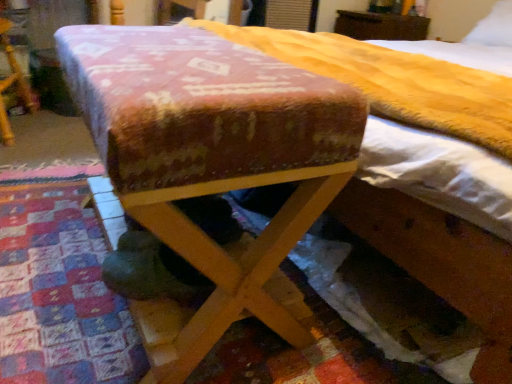
You are a GUI agent. You are given a task and a screenshot of the screen. Output one action in this format:
    pyautogui.click(x=<x>, y=<y>)
    Task: Click on the textured wool mattress at center
    
    Given the screenshot: What is the action you would take?
    (395, 82)

The height and width of the screenshot is (384, 512). What do you see at coordinates (211, 156) in the screenshot?
I see `velvet-like fabric ottoman at center, which appears as the 1th furniture when ordered from the bottom` at bounding box center [211, 156].

This screenshot has width=512, height=384. I want to click on white soft pillow at upper right, so click(493, 27).

The width and height of the screenshot is (512, 384). In order to click on wooden bed at center in this screenshot , I will do `click(395, 298)`.

I want to click on brown wooden dresser at upper center, the 1th furniture viewed from the right, so click(381, 26).

Image resolution: width=512 pixels, height=384 pixels. In order to click on textured wool mattress at center in this screenshot , I will do `click(395, 82)`.

From the image's perspective, is velvet-like fabric ottoman at center, the second furniture when ordered from left to right, on white soft pillow at upper right?

No, from the image's perspective, velvet-like fabric ottoman at center, the second furniture when ordered from left to right, is not over white soft pillow at upper right.

Does velvet-like fabric ottoman at center, acting as the 3th furniture starting from the top, have a larger size compared to white soft pillow at upper right?

Yes.

Is velvet-like fabric ottoman at center, acting as the 3th furniture starting from the top, facing towards white soft pillow at upper right?

No, velvet-like fabric ottoman at center, acting as the 3th furniture starting from the top, is not aimed at white soft pillow at upper right.

Are brown wooden dresser at upper center, the 1th furniture viewed from the right, and wooden bed at center beside each other?

No, brown wooden dresser at upper center, the 1th furniture viewed from the right, is not beside wooden bed at center.

Is brown wooden dresser at upper center, the 3th furniture from the bottom, taller than wooden bed at center?

No.

Consider the image. From a real-world perspective, which object rests below the other?

wooden bed at center.

Is brown wooden dresser at upper center, the 1th furniture viewed from the right, smaller than wooden bed at center?

Yes, brown wooden dresser at upper center, the 1th furniture viewed from the right, is smaller than wooden bed at center.

Can you tell me how much velvet-like fabric ottoman at center, acting as the 3th furniture starting from the top, and wooden folding table at center, marked as the 2th furniture in a front-to-back arrangement, differ in facing direction?

94.6 degrees separate the facing orientations of velvet-like fabric ottoman at center, acting as the 3th furniture starting from the top, and wooden folding table at center, marked as the 2th furniture in a front-to-back arrangement.

From the image's perspective, is velvet-like fabric ottoman at center, the second furniture when ordered from left to right, above or below wooden folding table at center, marked as the 2th furniture in a back-to-front arrangement?

velvet-like fabric ottoman at center, the second furniture when ordered from left to right, is situated lower than wooden folding table at center, marked as the 2th furniture in a back-to-front arrangement, in the image.

Does velvet-like fabric ottoman at center, the second furniture in the right-to-left sequence, turn towards wooden folding table at center, positioned as the 2th furniture in bottom-to-top order?

No, velvet-like fabric ottoman at center, the second furniture in the right-to-left sequence, is not oriented towards wooden folding table at center, positioned as the 2th furniture in bottom-to-top order.

Is point (6, 85) closer or farther from the camera than point (362, 27)?

Point (6, 85) appears to be closer to the viewer than point (362, 27).

Does wooden folding table at center, marked as the 2th furniture in a back-to-front arrangement, turn towards brown wooden dresser at upper center, the third furniture viewed from the front?

No, wooden folding table at center, marked as the 2th furniture in a back-to-front arrangement, is not facing towards brown wooden dresser at upper center, the third furniture viewed from the front.

Is wooden folding table at center, positioned as the 2th furniture in bottom-to-top order, at the right side of brown wooden dresser at upper center, the third furniture from the left?

No, wooden folding table at center, positioned as the 2th furniture in bottom-to-top order, is not to the right of brown wooden dresser at upper center, the third furniture from the left.

Locate an element on the screen. furniture that is the 2nd object to the right of the wooden folding table at center, which ranks as the first furniture in left-to-right order, starting at the anchor is located at coordinates (381, 26).

Which object is closer to the camera taking this photo, velvet-like fabric ottoman at center, acting as the 3th furniture starting from the top, or wooden bed at center?

wooden bed at center is in front.

Consider the image. Does velvet-like fabric ottoman at center, the third furniture in the back-to-front sequence, have a lesser height compared to wooden bed at center?

Indeed, velvet-like fabric ottoman at center, the third furniture in the back-to-front sequence, has a lesser height compared to wooden bed at center.

Looking at their sizes, would you say velvet-like fabric ottoman at center, which appears as the 1th furniture when ordered from the bottom, is wider or thinner than wooden bed at center?

velvet-like fabric ottoman at center, which appears as the 1th furniture when ordered from the bottom, is thinner than wooden bed at center.

Are velvet-like fabric ottoman at center, the first furniture when ordered from front to back, and brown wooden dresser at upper center, placed as the 1th furniture when sorted from back to front, making contact?

No, velvet-like fabric ottoman at center, the first furniture when ordered from front to back, is not making contact with brown wooden dresser at upper center, placed as the 1th furniture when sorted from back to front.

Is velvet-like fabric ottoman at center, acting as the 3th furniture starting from the top, not inside brown wooden dresser at upper center, the 3th furniture from the bottom?

Yes.

From the image's perspective, is velvet-like fabric ottoman at center, the third furniture in the back-to-front sequence, below brown wooden dresser at upper center, the third furniture from the left?

Yes.

Is white soft pillow at upper right inside the boundaries of brown wooden dresser at upper center, the third furniture viewed from the front, or outside?

white soft pillow at upper right is located beyond the bounds of brown wooden dresser at upper center, the third furniture viewed from the front.

Between white soft pillow at upper right and brown wooden dresser at upper center, placed as the 1th furniture when sorted from back to front, which one has smaller size?

white soft pillow at upper right.

From a real-world perspective, is white soft pillow at upper right located higher than brown wooden dresser at upper center, the third furniture from the left?

Indeed, from a real-world perspective, white soft pillow at upper right stands above brown wooden dresser at upper center, the third furniture from the left.

Is white soft pillow at upper right wider than brown wooden dresser at upper center, the third furniture viewed from the front?

No.

There is a white soft pillow at upper right. Identify the location of the 2nd furniture below it (from a real-world perspective). (211, 156).

You are a GUI agent. You are given a task and a screenshot of the screen. Output one action in this format:
    pyautogui.click(x=<x>, y=<y>)
    Task: Click on the 3rd furniture behind the wooden bed at center, starting your count from the anchor
    
    Given the screenshot: What is the action you would take?
    pyautogui.click(x=381, y=26)

Estimate the real-world distances between objects in this image. Which object is closer to velvet-like fabric ottoman at center, the second furniture when ordered from left to right, brown wooden dresser at upper center, placed as the 1th furniture when sorted from back to front, or wooden folding table at center, the third furniture positioned from the right?

wooden folding table at center, the third furniture positioned from the right, lies closer to velvet-like fabric ottoman at center, the second furniture when ordered from left to right, than the other object.

Based on their spatial positions, is velvet-like fabric ottoman at center, which appears as the 1th furniture when ordered from the bottom, or brown wooden dresser at upper center, placed as the 1th furniture when sorted from back to front, closer to wooden bed at center?

The object closer to wooden bed at center is velvet-like fabric ottoman at center, which appears as the 1th furniture when ordered from the bottom.

Estimate the real-world distances between objects in this image. Which object is further from textured wool mattress at center, velvet-like fabric ottoman at center, the second furniture in the right-to-left sequence, or white soft pillow at upper right?

white soft pillow at upper right is positioned further to the anchor textured wool mattress at center.

Considering their positions, is wooden bed at center positioned further to velvet-like fabric ottoman at center, acting as the 3th furniture starting from the top, than textured wool mattress at center?

The object further to velvet-like fabric ottoman at center, acting as the 3th furniture starting from the top, is wooden bed at center.

From the image, which object appears to be farther from wooden bed at center, wooden folding table at center, marked as the 2th furniture in a front-to-back arrangement, or velvet-like fabric ottoman at center, the second furniture in the right-to-left sequence?

Based on the image, wooden folding table at center, marked as the 2th furniture in a front-to-back arrangement, appears to be further to wooden bed at center.

Looking at this image, estimate the real-world distances between objects in this image. Which object is closer to white soft pillow at upper right, textured wool mattress at center or wooden bed at center?

textured wool mattress at center is positioned closer to the anchor white soft pillow at upper right.

When comparing their distances from textured wool mattress at center, does wooden folding table at center, which ranks as the first furniture in left-to-right order, or brown wooden dresser at upper center, the 1th furniture viewed from the right, seem closer?

Among the two, wooden folding table at center, which ranks as the first furniture in left-to-right order, is located nearer to textured wool mattress at center.

Which object lies further to the anchor point wooden bed at center, textured wool mattress at center or white soft pillow at upper right?

The object further to wooden bed at center is white soft pillow at upper right.

This screenshot has height=384, width=512. I want to click on mattress between wooden folding table at center, which ranks as the first furniture in left-to-right order, and wooden bed at center, in the horizontal direction, so click(395, 82).

Locate an element on the screen. This screenshot has height=384, width=512. mattress between wooden folding table at center, marked as the 2th furniture in a front-to-back arrangement, and brown wooden dresser at upper center, the third furniture from the left, in the horizontal direction is located at coordinates click(x=395, y=82).

You are a GUI agent. You are given a task and a screenshot of the screen. Output one action in this format:
    pyautogui.click(x=<x>, y=<y>)
    Task: Click on the bed between wooden folding table at center, which ranks as the first furniture in left-to-right order, and white soft pillow at upper right from left to right
    The height and width of the screenshot is (384, 512).
    Given the screenshot: What is the action you would take?
    pyautogui.click(x=395, y=298)

Identify the location of mattress between wooden bed at center and white soft pillow at upper right in the front-back direction. The height and width of the screenshot is (384, 512). (395, 82).